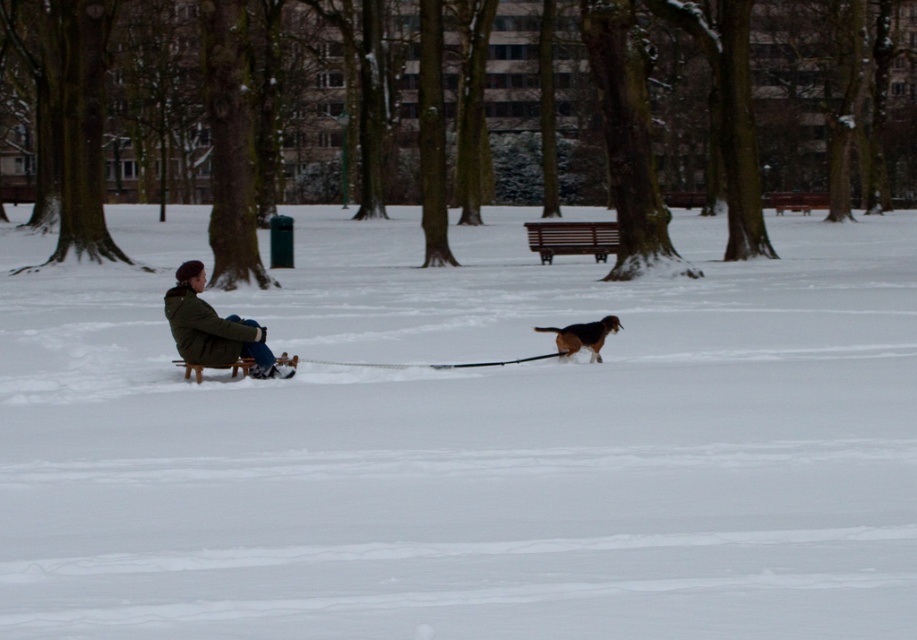
You are a photographer planning to take a picture of the scene. You want to ensure that both the white fluffy snow at center and the green matte jacket at left are clearly visible in your shot. Based on their positions, which object should you focus on first to ensure both are in frame?

The white fluffy snow at center is positioned on the right side of green matte jacket at left. To ensure both are in frame, focus on the green matte jacket at left first since it is closer to the left edge, allowing the camera to capture the entire area from left to right, including the snow on the right.

You are standing in the winter park scene described. You want to place a small wooden sled exactly where the white fluffy snow at center is located. Is the sled currently there?

The sled is currently at the position of the white fluffy snow at center, which is at coordinates point (467,442). So yes, the sled is already placed there.